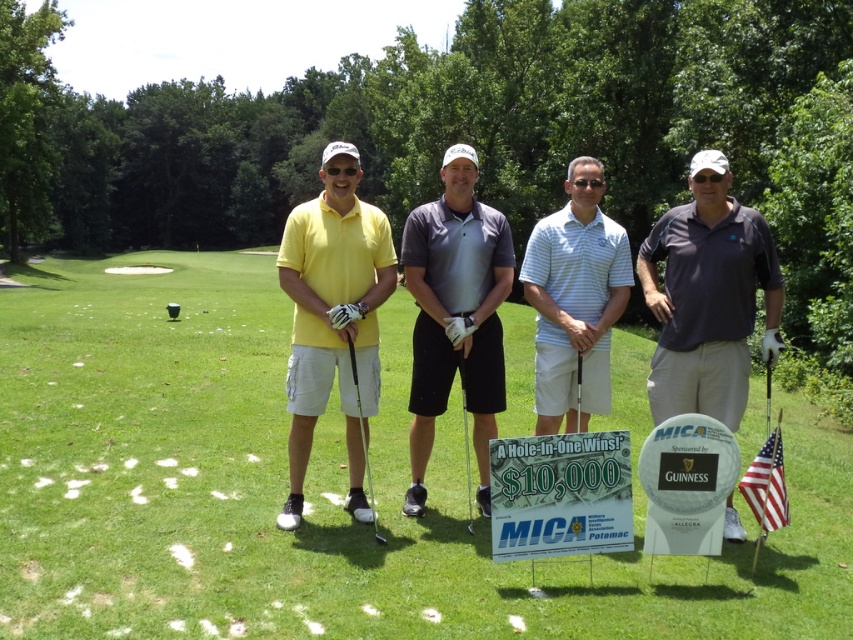
Question: Which is farther from the black metallic golf club at center?

Choices:
 (A) matte black golf club at center
 (B) matte gray polo shirt at center
 (C) metallic silver golf club at right

Answer: (C)

Question: Does black metallic golf club at center have a lesser width compared to metallic silver golf club at right?

Choices:
 (A) yes
 (B) no

Answer: (A)

Question: Which object is the closest to the light blue striped polo shirt at center?

Choices:
 (A) matte black golf club at center
 (B) matte yellow shirt at center
 (C) dark gray polo shirt at center

Answer: (C)

Question: Can you confirm if green grass at center is smaller than matte gray polo shirt at center?

Choices:
 (A) yes
 (B) no

Answer: (B)

Question: Which of the following is the closest to the observer?

Choices:
 (A) (280, 452)
 (B) (576, 259)
 (C) (460, 234)
 (D) (367, 467)

Answer: (D)

Question: Does matte gray polo shirt at center have a lesser width compared to metallic silver golf club at right?

Choices:
 (A) no
 (B) yes

Answer: (B)